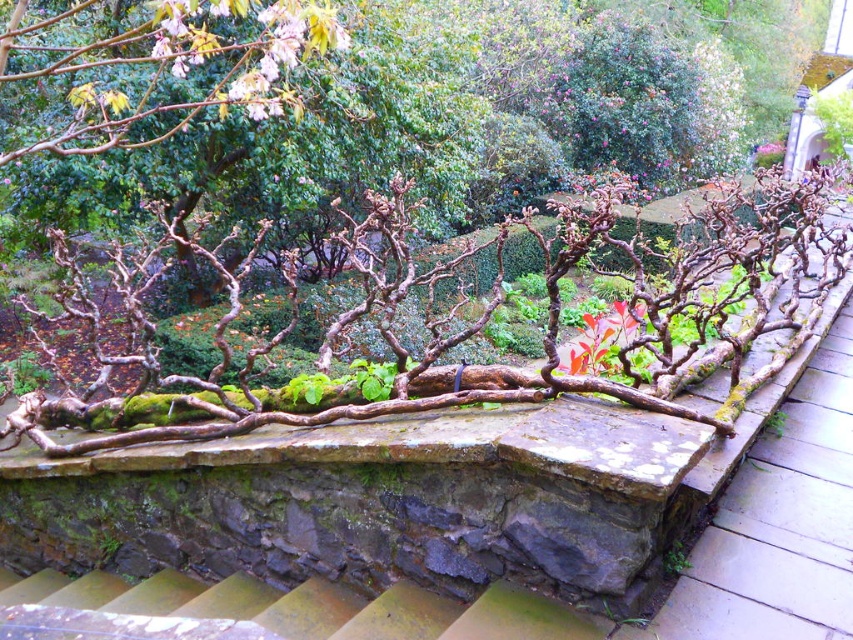
Question: Is rusty metal stairs at lower left further to camera compared to glossy red leaf at center?

Choices:
 (A) no
 (B) yes

Answer: (A)

Question: Does rusty metal stairs at lower left come in front of glossy red leaf at center?

Choices:
 (A) yes
 (B) no

Answer: (A)

Question: Which object appears closest to the camera in this image?

Choices:
 (A) glossy red leaf at center
 (B) brown stone path at center
 (C) rusty metal stairs at lower left

Answer: (C)

Question: Among these objects, which one is farthest from the camera?

Choices:
 (A) rusty metal stairs at lower left
 (B) glossy red leaf at center

Answer: (B)

Question: Which object appears farthest from the camera in this image?

Choices:
 (A) brown stone path at center
 (B) glossy red leaf at center
 (C) rusty metal stairs at lower left

Answer: (B)

Question: Can you confirm if rusty metal stairs at lower left is positioned to the left of glossy red leaf at center?

Choices:
 (A) no
 (B) yes

Answer: (B)